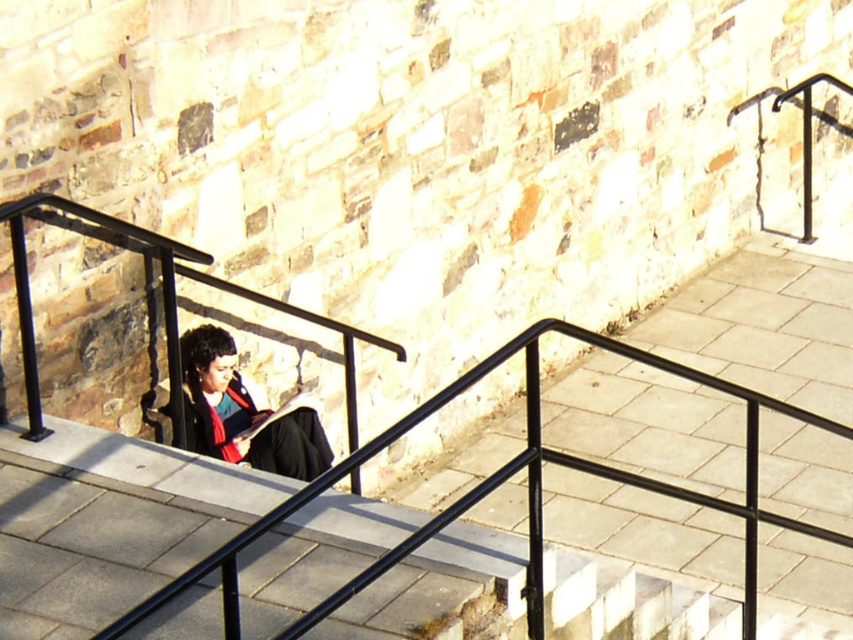
You are a painter setting up an easel to capture the scene. You need to ensure that the black metal railing at center and the matte black jacket at center are both visible in your painting. Given that the railing is wider than the jacket, which object should you position closer to the center of your canvas to maintain their relative sizes?

Since the black metal railing at center is wider than the matte black jacket at center, to maintain their relative sizes in the painting, you should position the matte black jacket at center closer to the center of the canvas. This adjustment ensures that even though the jacket is smaller in reality, its central placement will help preserve the perceived size relationship between the two objects.

You are a painter who wants to capture the scene of the person sitting on the stone staircase. You need to decide whether the black metal railing at center will block the view of the matte black jacket at center in your painting. Can you determine this based on their positions and sizes?

The black metal railing at center has a greater height compared to the matte black jacket at center, so it may block the view of the jacket depending on the angle and perspective in the painting.